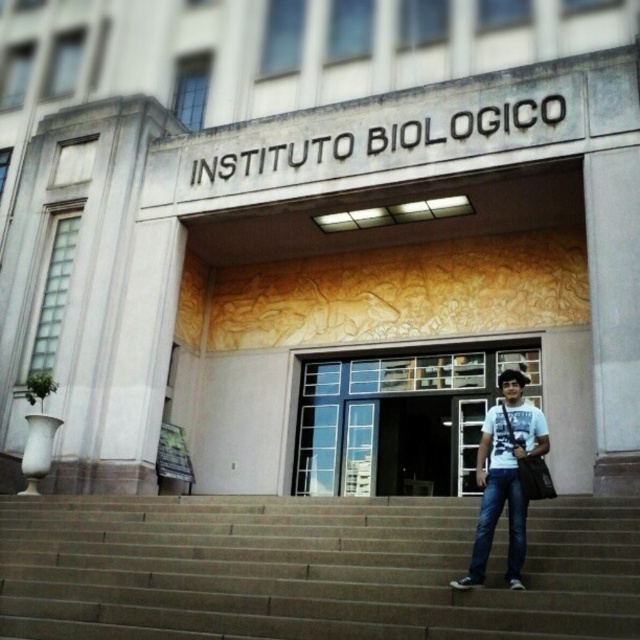
Question: Among these objects, which one is farthest from the camera?

Choices:
 (A) white cotton t-shirt at center
 (B) clear glass door at center
 (C) brown concrete stairs at center

Answer: (B)

Question: Is clear glass door at center behind white cotton t-shirt at center?

Choices:
 (A) yes
 (B) no

Answer: (A)

Question: Can you confirm if brown concrete stairs at center is positioned above jeans at center?

Choices:
 (A) yes
 (B) no

Answer: (B)

Question: Which point is farther to the camera?

Choices:
 (A) white cotton t-shirt at center
 (B) jeans at center
 (C) clear glass door at center

Answer: (C)

Question: Which object is the closest to the white cotton t-shirt at center?

Choices:
 (A) clear glass door at center
 (B) brown concrete stairs at center
 (C) jeans at center

Answer: (C)

Question: Observing the image, what is the correct spatial positioning of clear glass door at center in reference to jeans at center?

Choices:
 (A) left
 (B) right

Answer: (B)